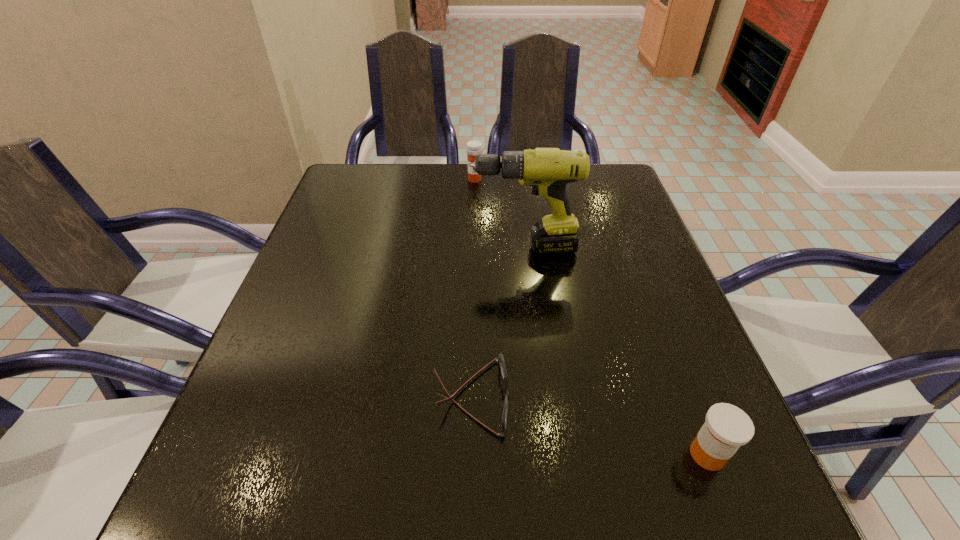
At what (x,y) coordinates should I click in order to perform the action: click on free space between the shortest object and the second shortest object. Please return your answer as a coordinate pair (x, y). The image size is (960, 540). Looking at the image, I should click on pyautogui.click(x=589, y=426).

What are the coordinates of `unoccupied position between the right medicine and the left medicine` in the screenshot? It's located at (591, 317).

You are a GUI agent. You are given a task and a screenshot of the screen. Output one action in this format:
    pyautogui.click(x=<x>, y=<y>)
    Task: Click on the free space between the shortest object and the nearer medicine
    This screenshot has height=540, width=960.
    Given the screenshot: What is the action you would take?
    pyautogui.click(x=589, y=426)

Where is `free space between the farther medicine and the tallest object`? The width and height of the screenshot is (960, 540). free space between the farther medicine and the tallest object is located at coordinates (499, 213).

Locate an element on the screen. The width and height of the screenshot is (960, 540). object that stands as the second closest to the third tallest object is located at coordinates (548, 170).

Identify the location of object identified as the closest to the tallest object. (474, 148).